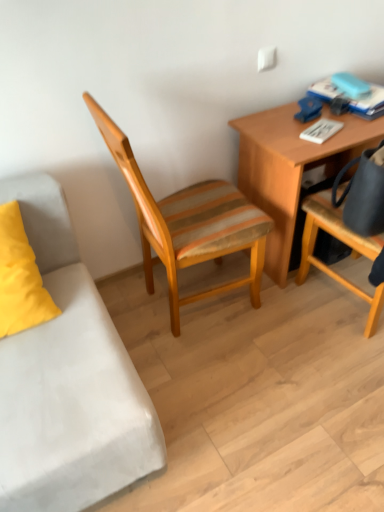
Question: Is wooden desk at upper right completely or partially outside of matte black bag at right, arranged as the second chair when viewed from the left?

Choices:
 (A) no
 (B) yes

Answer: (B)

Question: Is wooden desk at upper right positioned with its back to matte black bag at right, the 1th chair positioned from the right?

Choices:
 (A) yes
 (B) no

Answer: (B)

Question: Considering the relative sizes of wooden desk at upper right and matte black bag at right, the 1th chair positioned from the right, in the image provided, is wooden desk at upper right taller than matte black bag at right, the 1th chair positioned from the right,?

Choices:
 (A) no
 (B) yes

Answer: (A)

Question: Is wooden desk at upper right bigger than matte black bag at right, arranged as the second chair when viewed from the left?

Choices:
 (A) yes
 (B) no

Answer: (B)

Question: Does wooden desk at upper right have a lesser width compared to matte black bag at right, the 1th chair positioned from the right?

Choices:
 (A) no
 (B) yes

Answer: (B)

Question: From a real-world perspective, is wooden desk at upper right on top of matte black bag at right, the 1th chair positioned from the right?

Choices:
 (A) yes
 (B) no

Answer: (B)

Question: Considering the relative positions of matte black bag at right, the 1th chair positioned from the right, and wooden desk at upper right in the image provided, is matte black bag at right, the 1th chair positioned from the right, to the right of wooden desk at upper right from the viewer's perspective?

Choices:
 (A) yes
 (B) no

Answer: (A)

Question: Is matte black bag at right, arranged as the second chair when viewed from the left, taller than wooden desk at upper right?

Choices:
 (A) no
 (B) yes

Answer: (B)

Question: Is matte black bag at right, the 1th chair positioned from the right, aimed at wooden desk at upper right?

Choices:
 (A) yes
 (B) no

Answer: (A)

Question: Is matte black bag at right, arranged as the second chair when viewed from the left, smaller than wooden desk at upper right?

Choices:
 (A) yes
 (B) no

Answer: (B)

Question: From a real-world perspective, is matte black bag at right, arranged as the second chair when viewed from the left, on top of wooden desk at upper right?

Choices:
 (A) no
 (B) yes

Answer: (B)

Question: Would you say wooden desk at upper right is part of matte black bag at right, the 1th chair positioned from the right,'s contents?

Choices:
 (A) yes
 (B) no

Answer: (B)

Question: Would you say woodenchair at center, which is the second chair in right-to-left order, contains wooden desk at upper right?

Choices:
 (A) no
 (B) yes

Answer: (A)